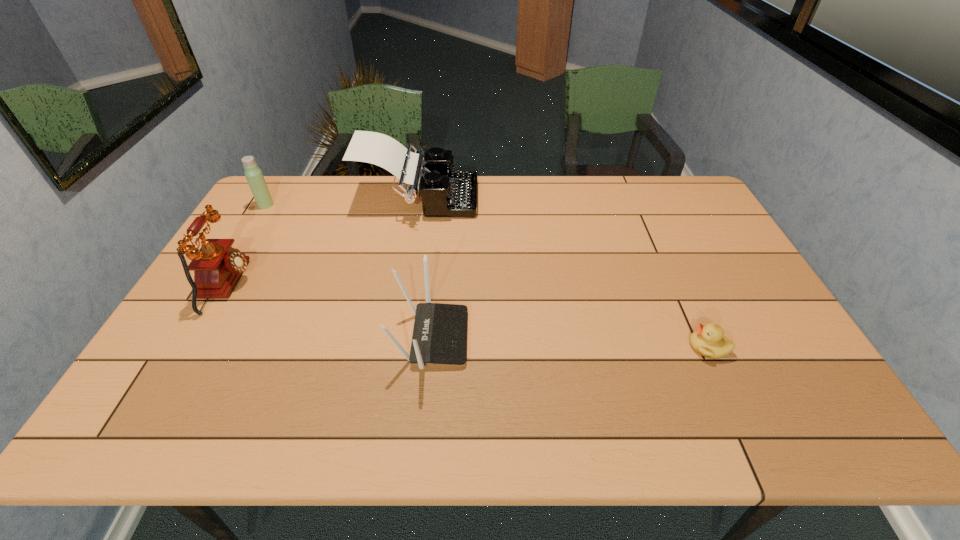
The width and height of the screenshot is (960, 540). I want to click on free space at the left edge of the desktop, so click(183, 345).

In the image, there is a desktop. Where is `blank space at the right edge`? The height and width of the screenshot is (540, 960). blank space at the right edge is located at coordinates click(x=800, y=395).

Where is `free space at the far left corner of the desktop`? free space at the far left corner of the desktop is located at coordinates (280, 199).

Image resolution: width=960 pixels, height=540 pixels. Identify the location of vacant space at the near right corner of the desktop. (787, 408).

Find the location of a particular element. free space between the router and the shortest object is located at coordinates (569, 342).

You are a GUI agent. You are given a task and a screenshot of the screen. Output one action in this format:
    pyautogui.click(x=<x>, y=<y>)
    Task: Click on the free space that is in between the shortest object and the router
    
    Given the screenshot: What is the action you would take?
    pyautogui.click(x=569, y=342)

Find the location of a particular element. The width and height of the screenshot is (960, 540). blank region between the duckling and the router is located at coordinates (569, 342).

This screenshot has height=540, width=960. I want to click on empty location between the thermos bottle and the telephone, so click(x=247, y=245).

Locate an element on the screen. free spot between the typewriter and the rightmost object is located at coordinates (564, 273).

Where is `free space between the telephone and the router`? free space between the telephone and the router is located at coordinates (329, 312).